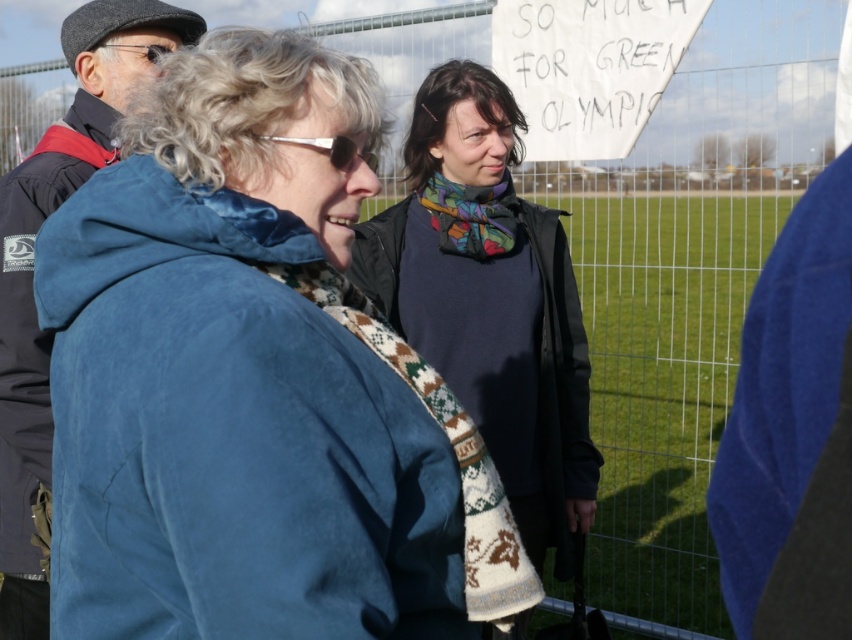
Which is below, green grass at center or velvet blue jacket at left?

velvet blue jacket at left is below.

Is the position of green grass at center more distant than that of velvet blue jacket at left?

Yes, it is.

Consider the image. Who is more forward, (671, 566) or (50, 188)?

Point (50, 188) is more forward.

At what (x,y) coordinates should I click in order to perform the action: click on green grass at center. Please return your answer as a coordinate pair (x, y). The width and height of the screenshot is (852, 640). Looking at the image, I should click on (661, 384).

Which of these two, dark blue sweater at center or green grass at center, stands taller?

Standing taller between the two is dark blue sweater at center.

Is dark blue sweater at center smaller than green grass at center?

Actually, dark blue sweater at center might be larger than green grass at center.

Locate an element on the screen. dark blue sweater at center is located at coordinates (490, 301).

Can you confirm if blue suede jacket at center is bigger than velvet blue jacket at left?

Actually, blue suede jacket at center might be smaller than velvet blue jacket at left.

Is blue suede jacket at center to the right of velvet blue jacket at left from the viewer's perspective?

Yes, blue suede jacket at center is to the right of velvet blue jacket at left.

Where is `blue suede jacket at center`? blue suede jacket at center is located at coordinates (252, 380).